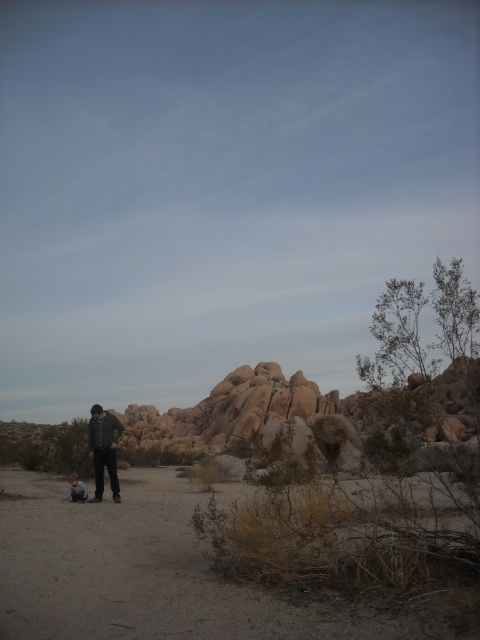
Which is more to the left, dark gray jacket at center or light brown skin at lower center?

light brown skin at lower center

Describe the element at coordinates (104, 449) in the screenshot. I see `dark gray jacket at center` at that location.

The image size is (480, 640). I want to click on dark gray jacket at center, so click(x=104, y=449).